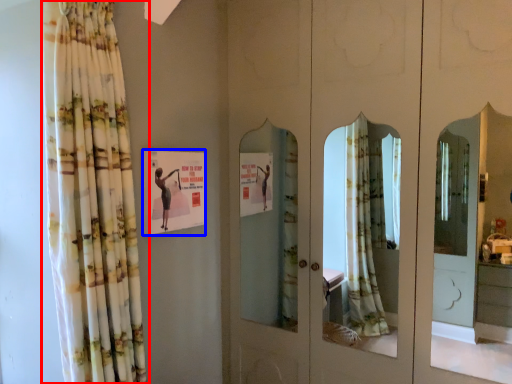
Question: Among these objects, which one is farthest to the camera, curtain (highlighted by a red box) or postcard (highlighted by a blue box)?

Choices:
 (A) curtain
 (B) postcard

Answer: (B)